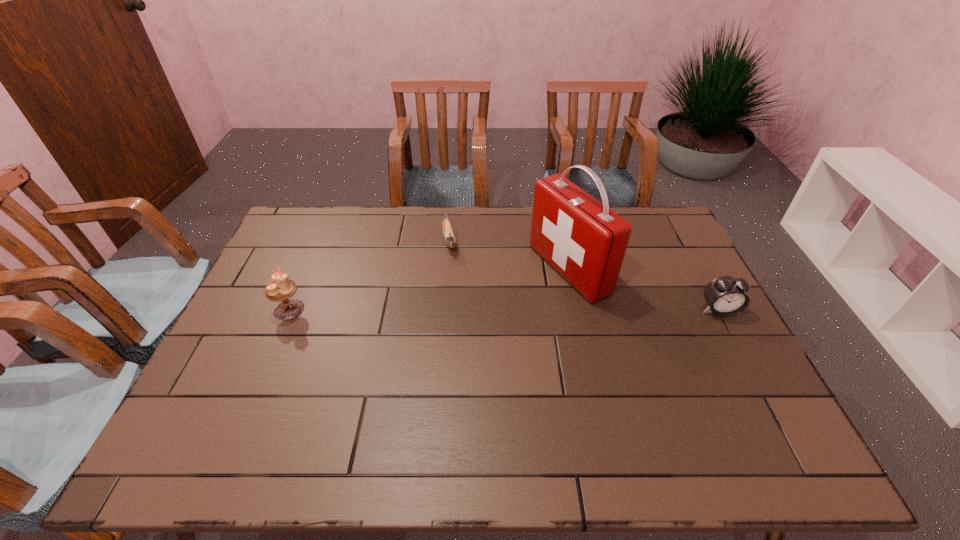
Identify the location of the third shortest object. This screenshot has height=540, width=960. (283, 288).

At what (x,y) coordinates should I click in order to perform the action: click on the leftmost object. Please return your answer as a coordinate pair (x, y). This screenshot has width=960, height=540. Looking at the image, I should click on (283, 288).

Identify the location of the third tallest object. (726, 296).

I want to click on the rightmost object, so click(726, 296).

This screenshot has height=540, width=960. In order to click on the second object from left to right in this screenshot , I will do `click(449, 236)`.

You are a GUI agent. You are given a task and a screenshot of the screen. Output one action in this format:
    pyautogui.click(x=<x>, y=<y>)
    Task: Click on the banana
    This screenshot has height=540, width=960.
    Given the screenshot: What is the action you would take?
    pyautogui.click(x=449, y=236)

Find the location of a particular element. The width and height of the screenshot is (960, 540). the tallest object is located at coordinates (582, 239).

Find the location of `the second object from right to left`. the second object from right to left is located at coordinates (582, 239).

Find the location of a particular element. vacant area located 0.230m on the back of the second tallest object is located at coordinates (315, 251).

This screenshot has height=540, width=960. In order to click on blank space located 0.140m on the front side of the alarm clock in this screenshot , I will do `click(745, 358)`.